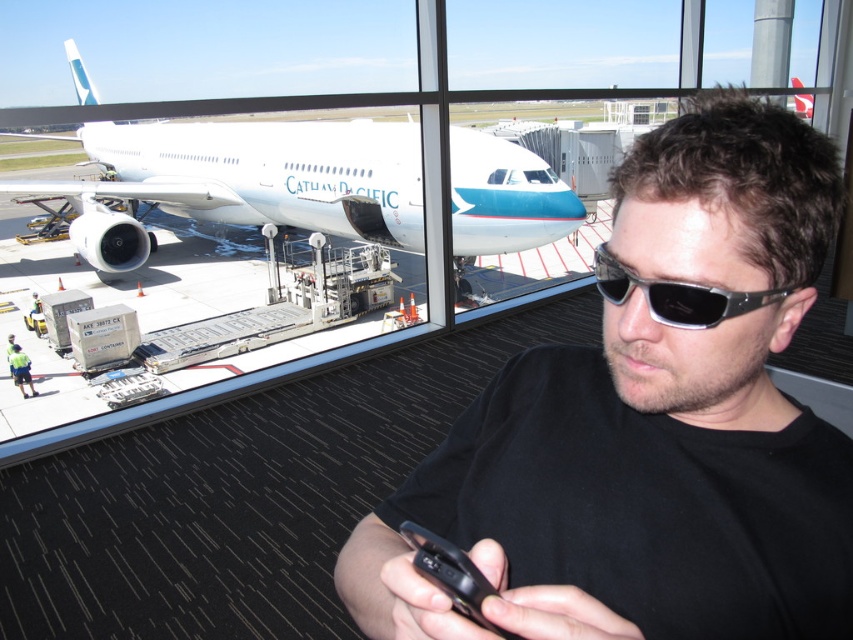
Question: Which is farther from the black matte shirt at center?

Choices:
 (A) white glossy airplane at upper left
 (B) sunglasses at center

Answer: (A)

Question: Among these objects, which one is farthest from the camera?

Choices:
 (A) white glossy airplane at upper left
 (B) sunglasses at center

Answer: (A)

Question: In this image, where is black matte shirt at center located relative to white glossy airplane at upper left?

Choices:
 (A) above
 (B) below

Answer: (B)

Question: Considering the relative positions of black matte shirt at center and white glossy airplane at upper left in the image provided, where is black matte shirt at center located with respect to white glossy airplane at upper left?

Choices:
 (A) right
 (B) left

Answer: (A)

Question: Which point appears farthest from the camera in this image?

Choices:
 (A) (606, 275)
 (B) (100, 234)

Answer: (B)

Question: Can you confirm if black matte shirt at center is positioned to the right of white glossy airplane at upper left?

Choices:
 (A) no
 (B) yes

Answer: (B)